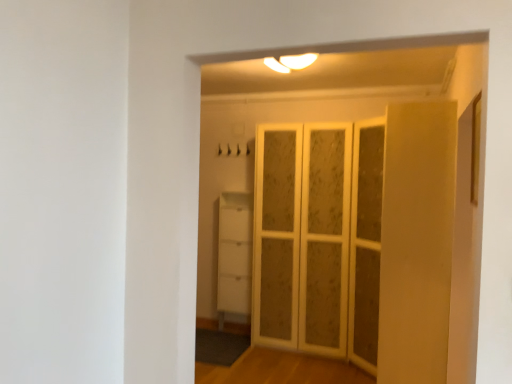
Question: Is white matte cabinet at lower center further to the viewer compared to white textured screen door at center?

Choices:
 (A) yes
 (B) no

Answer: (A)

Question: Is white matte cabinet at lower center shorter than white textured screen door at center?

Choices:
 (A) no
 (B) yes

Answer: (B)

Question: Is the depth of white matte cabinet at lower center less than that of white textured screen door at center?

Choices:
 (A) yes
 (B) no

Answer: (B)

Question: Is white matte cabinet at lower center in contact with white textured screen door at center?

Choices:
 (A) no
 (B) yes

Answer: (A)

Question: From a real-world perspective, is white matte cabinet at lower center beneath white textured screen door at center?

Choices:
 (A) yes
 (B) no

Answer: (A)

Question: Is white matte cabinet at lower center outside of white textured screen door at center?

Choices:
 (A) no
 (B) yes

Answer: (B)

Question: From a real-world perspective, is white textured screen door at center on top of white matte cabinet at lower center?

Choices:
 (A) no
 (B) yes

Answer: (B)

Question: Is white textured screen door at center bigger than white matte cabinet at lower center?

Choices:
 (A) no
 (B) yes

Answer: (B)

Question: Are white textured screen door at center and white matte cabinet at lower center far apart?

Choices:
 (A) yes
 (B) no

Answer: (B)

Question: Is white textured screen door at center facing towards white matte cabinet at lower center?

Choices:
 (A) no
 (B) yes

Answer: (A)

Question: Is white textured screen door at center further to camera compared to white matte cabinet at lower center?

Choices:
 (A) yes
 (B) no

Answer: (B)

Question: Does white textured screen door at center have a greater height compared to white matte cabinet at lower center?

Choices:
 (A) no
 (B) yes

Answer: (B)

Question: In terms of height, does white textured screen door at center look taller or shorter compared to white matte cabinet at lower center?

Choices:
 (A) short
 (B) tall

Answer: (B)